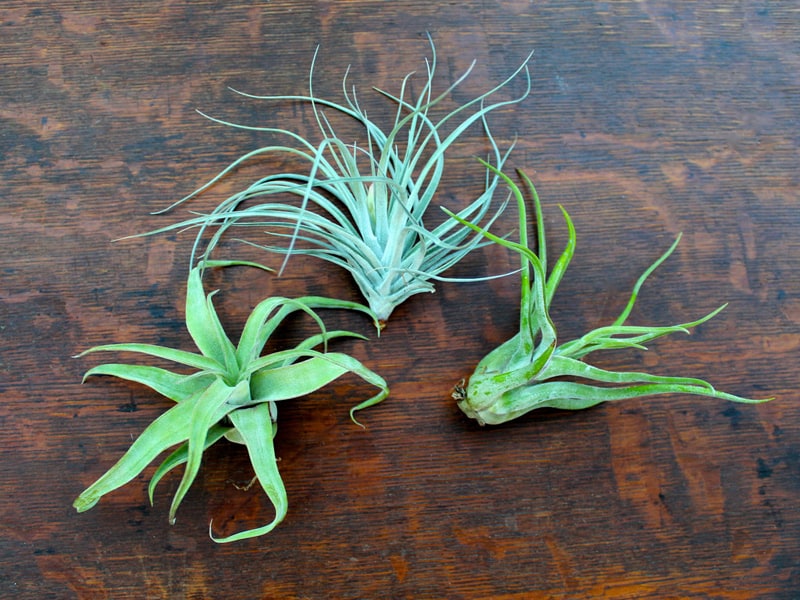
You are a GUI agent. You are given a task and a screenshot of the screen. Output one action in this format:
    pyautogui.click(x=<x>, y=<y>)
    Task: Click on the wood grain
    The height and width of the screenshot is (600, 800).
    Given the screenshot: What is the action you would take?
    pyautogui.click(x=444, y=509)